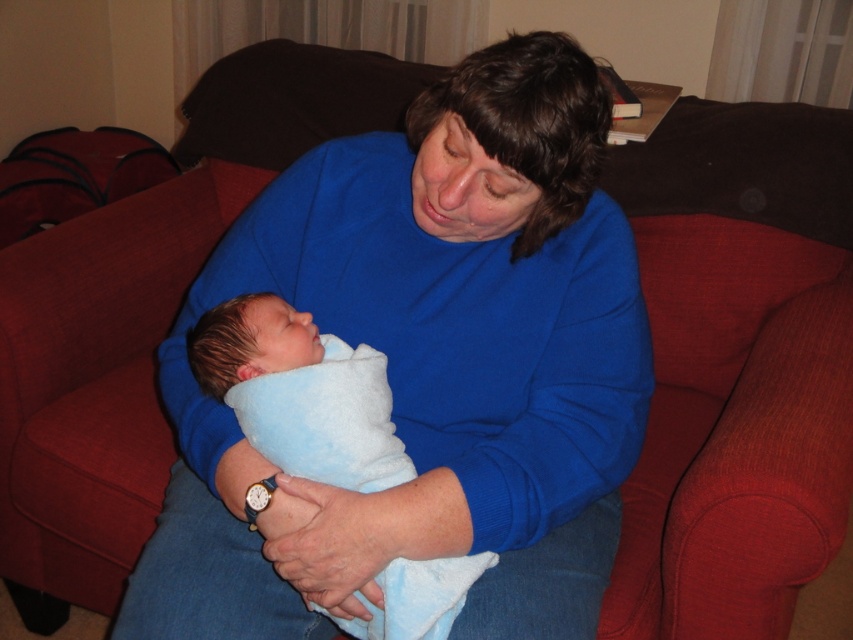
Which is more to the left, blue soft sweater at center or blue soft blanket at center?

blue soft blanket at center

Who is shorter, blue soft sweater at center or blue soft blanket at center?

blue soft blanket at center is shorter.

Locate an element on the screen. The width and height of the screenshot is (853, 640). blue soft sweater at center is located at coordinates (427, 369).